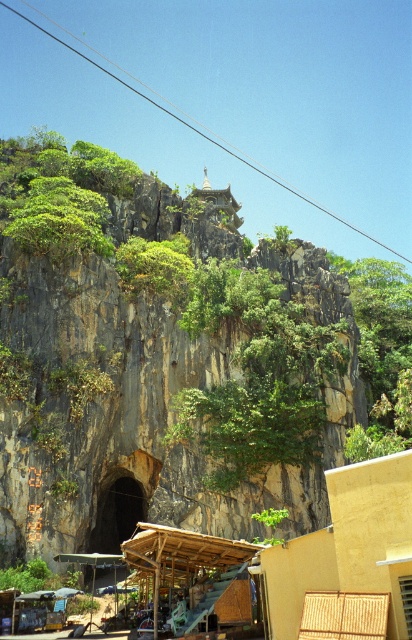
Measure the distance from beige wicker hut at lower right to wooden canopy at lower center.

10.00 meters

Can you confirm if beige wicker hut at lower right is wider than wooden canopy at lower center?

In fact, beige wicker hut at lower right might be narrower than wooden canopy at lower center.

The image size is (412, 640). I want to click on beige wicker hut at lower right, so click(x=346, y=561).

Find the location of a particular element. beige wicker hut at lower right is located at coordinates (346, 561).